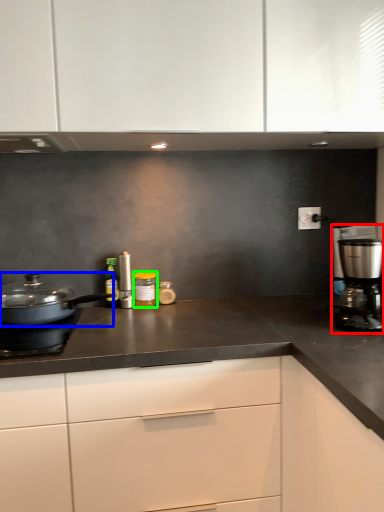
Question: Based on their relative distances, which object is nearer to kitchen appliance (highlighted by a red box)? Choose from home appliance (highlighted by a blue box) and kitchen appliance (highlighted by a green box).

Choices:
 (A) home appliance
 (B) kitchen appliance

Answer: (B)